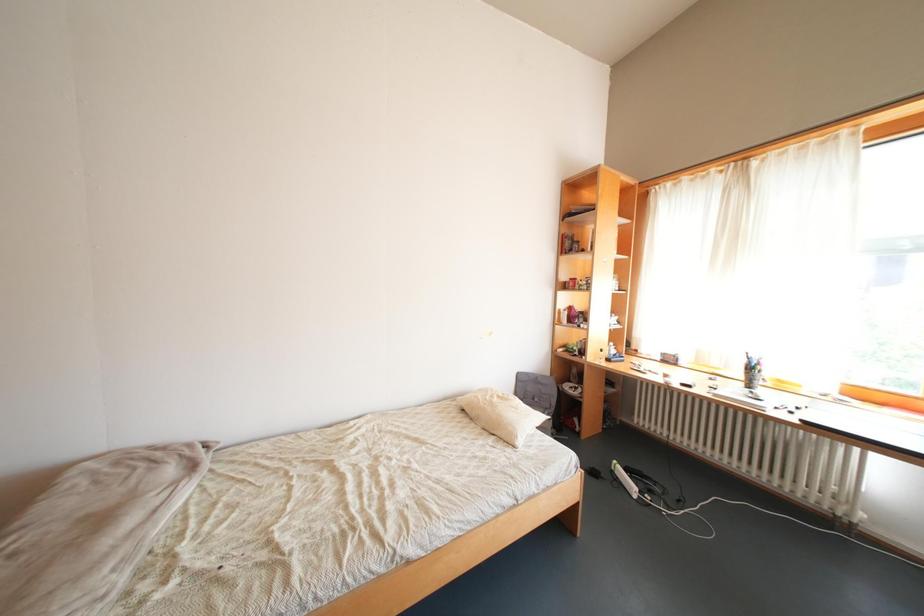
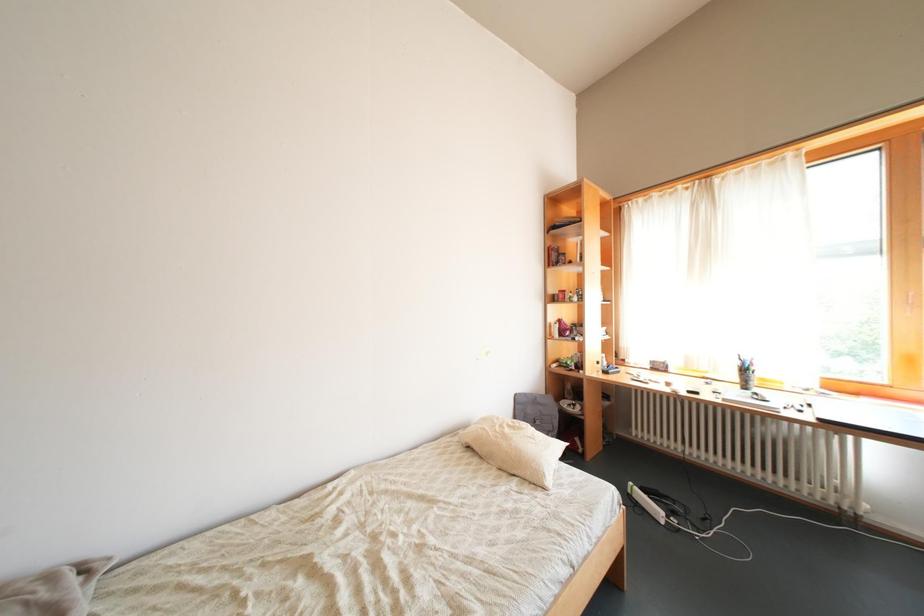
Question: The camera is either moving clockwise (left) or counter-clockwise (right) around the object. The first image is from the beginning of the video and the second image is from the end. Is the camera moving left or right when shooting the video?

Choices:
 (A) Left
 (B) Right

Answer: (A)